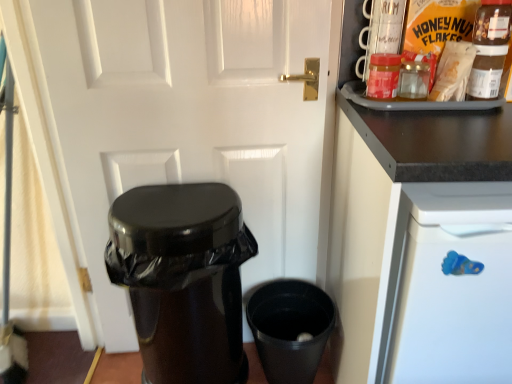
Question: Is matte plastic honey nut flakes at upper right, the 1th food from the back, smaller than black plastic cup at lower right?

Choices:
 (A) no
 (B) yes

Answer: (B)

Question: Does matte plastic honey nut flakes at upper right, positioned as the 2th food in front-to-back order, have a lesser height compared to black plastic cup at lower right?

Choices:
 (A) no
 (B) yes

Answer: (B)

Question: Would you consider matte plastic honey nut flakes at upper right, positioned as the 2th food in front-to-back order, to be distant from black plastic cup at lower right?

Choices:
 (A) no
 (B) yes

Answer: (A)

Question: Is matte plastic honey nut flakes at upper right, the 1th food from the back, closer to camera compared to black plastic cup at lower right?

Choices:
 (A) yes
 (B) no

Answer: (A)

Question: From the image's perspective, does matte plastic honey nut flakes at upper right, the 1th food from the back, appear lower than black plastic cup at lower right?

Choices:
 (A) yes
 (B) no

Answer: (B)

Question: Is matte plastic honey nut flakes at upper right, the 1th food from the back, touching black plastic cup at lower right?

Choices:
 (A) no
 (B) yes

Answer: (A)

Question: Considering the relative positions of black plastic cup at lower right and black glossy trash can at lower left in the image provided, is black plastic cup at lower right behind black glossy trash can at lower left?

Choices:
 (A) yes
 (B) no

Answer: (A)

Question: From the image's perspective, does black plastic cup at lower right appear higher than black glossy trash can at lower left?

Choices:
 (A) yes
 (B) no

Answer: (B)

Question: Considering the relative positions of black plastic cup at lower right and black glossy trash can at lower left in the image provided, is black plastic cup at lower right to the left of black glossy trash can at lower left from the viewer's perspective?

Choices:
 (A) no
 (B) yes

Answer: (A)

Question: Is black plastic cup at lower right oriented away from black glossy trash can at lower left?

Choices:
 (A) yes
 (B) no

Answer: (B)

Question: Is black plastic cup at lower right far away from black glossy trash can at lower left?

Choices:
 (A) no
 (B) yes

Answer: (A)

Question: Can black glossy trash can at lower left be found inside black plastic cup at lower right?

Choices:
 (A) yes
 (B) no

Answer: (B)

Question: Is the position of matte brown paper bag at upper right, acting as the 2th food starting from the back, more distant than that of matte plastic jar at upper right?

Choices:
 (A) yes
 (B) no

Answer: (B)